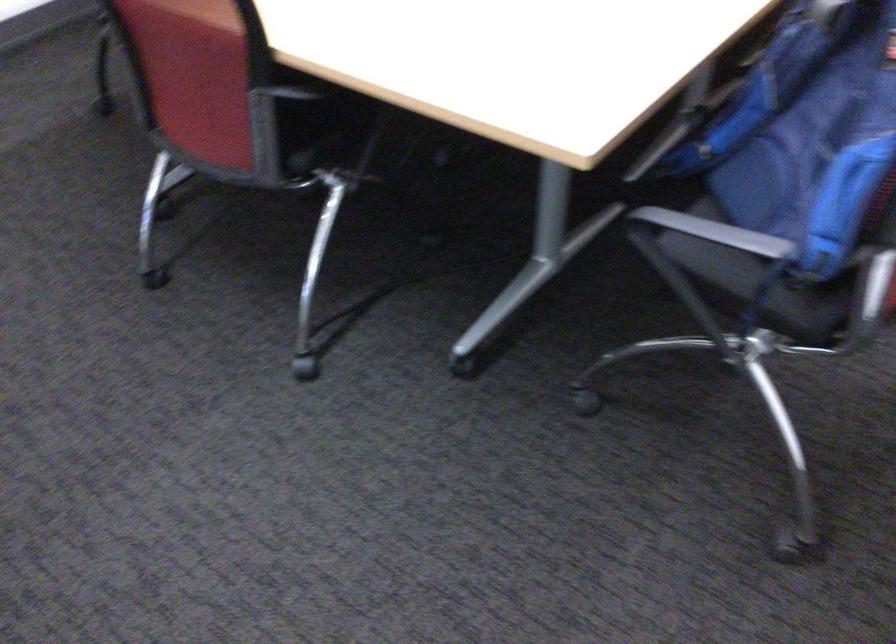
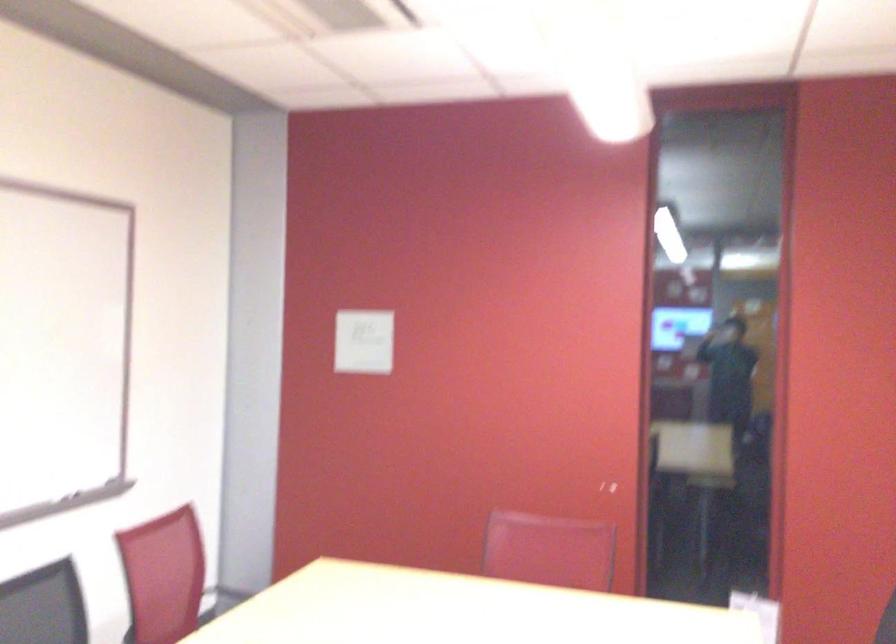
Based on the continuous images, in which direction is the camera rotating?

The rotation direction of the camera is right-up.